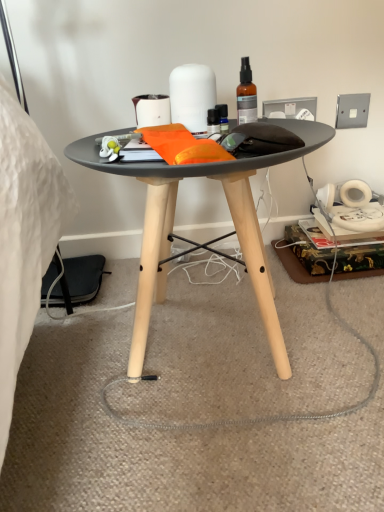
Question: Considering the positions of point click(x=158, y=94) and point click(x=208, y=96), is point click(x=158, y=94) closer or farther from the camera than point click(x=208, y=96)?

Choices:
 (A) farther
 (B) closer

Answer: (A)

Question: Is matte white toilet paper at upper center, arranged as the 2th toilet paper when viewed from the right, inside the boundaries of white matte diffuser at upper center, the 2th toilet paper when ordered from left to right, or outside?

Choices:
 (A) inside
 (B) outside

Answer: (B)

Question: Which object is the closest to the matte white toilet paper at upper center, which is the 1th toilet paper from left to right?

Choices:
 (A) matte black table at center
 (B) translucent amber glass spray bottle at upper center
 (C) white matte diffuser at upper center, the 2th toilet paper when ordered from left to right

Answer: (C)

Question: Which of these objects is positioned closest to the matte black table at center?

Choices:
 (A) translucent amber glass spray bottle at upper center
 (B) matte white toilet paper at upper center, arranged as the 2th toilet paper when viewed from the right
 (C) white matte diffuser at upper center, which is the first toilet paper in right-to-left order

Answer: (C)